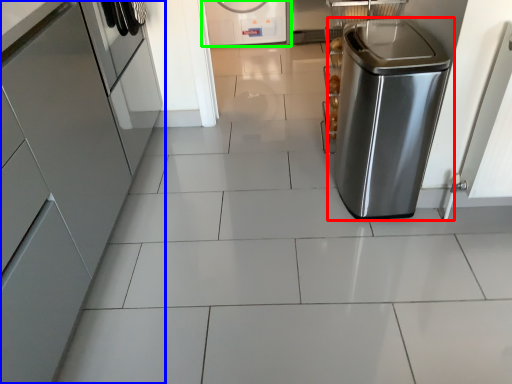
Question: Which object is positioned closest to home appliance (highlighted by a red box)? Select from home appliance (highlighted by a blue box) and home appliance (highlighted by a green box).

Choices:
 (A) home appliance
 (B) home appliance

Answer: (A)